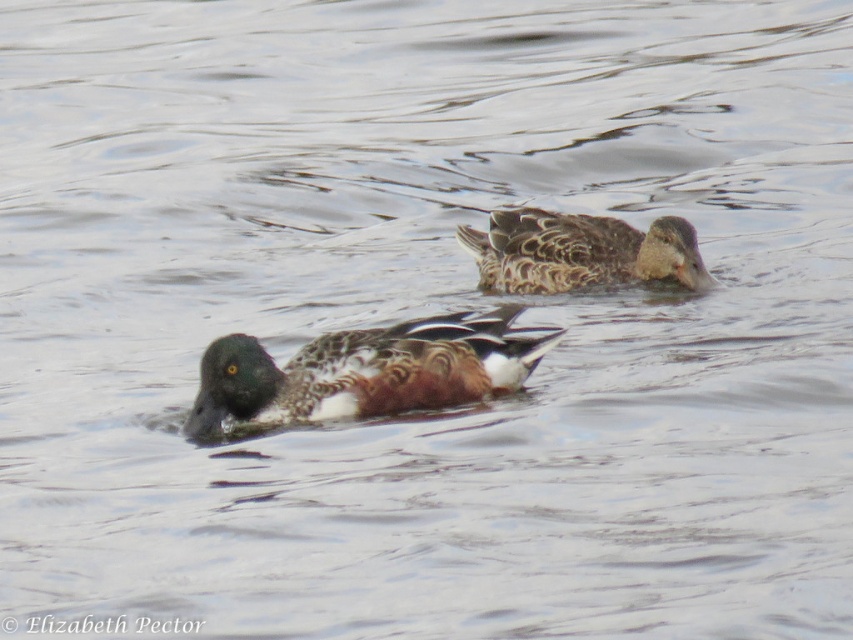
From the picture: Who is positioned more to the right, greenish-brown speckled duck at center or brown speckled duck at upper center?

brown speckled duck at upper center

Which is in front, point (363, 403) or point (473, 228)?

Positioned in front is point (363, 403).

Is point (328, 413) closer to viewer compared to point (608, 269)?

Yes, point (328, 413) is in front of point (608, 269).

Find the location of `greenish-brown speckled duck at center`. greenish-brown speckled duck at center is located at coordinates (366, 371).